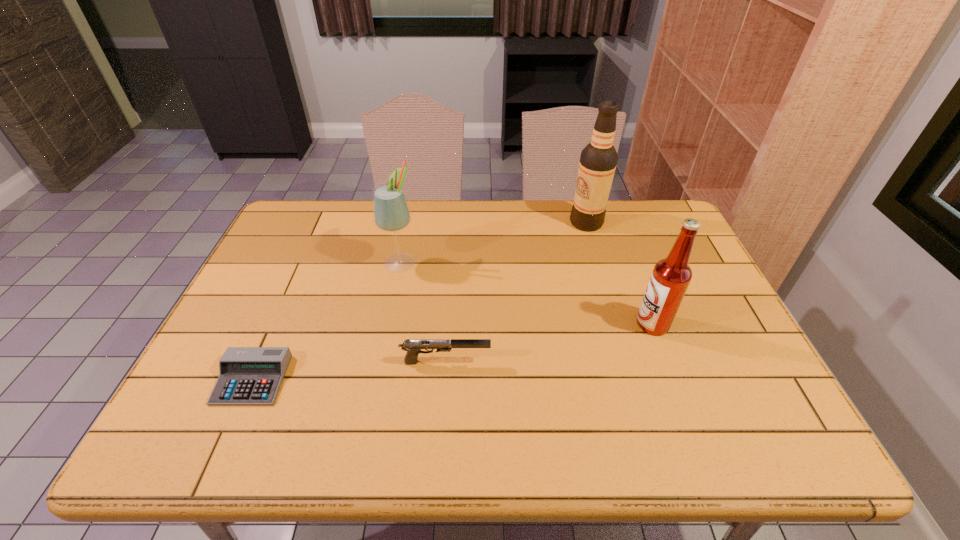
Image resolution: width=960 pixels, height=540 pixels. I want to click on vacant space located 0.110m on the label of the tallest object, so click(x=537, y=222).

Find the location of `blank area located on the left of the second nearest alcohol`. blank area located on the left of the second nearest alcohol is located at coordinates (270, 262).

Where is `free point located 0.210m on the label side of the third farthest object`? This screenshot has height=540, width=960. free point located 0.210m on the label side of the third farthest object is located at coordinates (556, 324).

This screenshot has width=960, height=540. In order to click on free region located on the label side of the third farthest object in this screenshot , I will do `click(579, 324)`.

Locate an element on the screen. vacant space located 0.270m on the label side of the third farthest object is located at coordinates click(533, 324).

Find the location of `vacant space located at the muzzle end of the second shortest object`. vacant space located at the muzzle end of the second shortest object is located at coordinates (589, 362).

Where is `vacant space situated 0.090m on the front of the calculator`? The height and width of the screenshot is (540, 960). vacant space situated 0.090m on the front of the calculator is located at coordinates (224, 444).

Image resolution: width=960 pixels, height=540 pixels. I want to click on object situated at the far edge, so click(598, 160).

Identify the location of object positioned at the left edge. The image size is (960, 540). (248, 376).

Identify the location of free space at the far edge of the desktop. (356, 218).